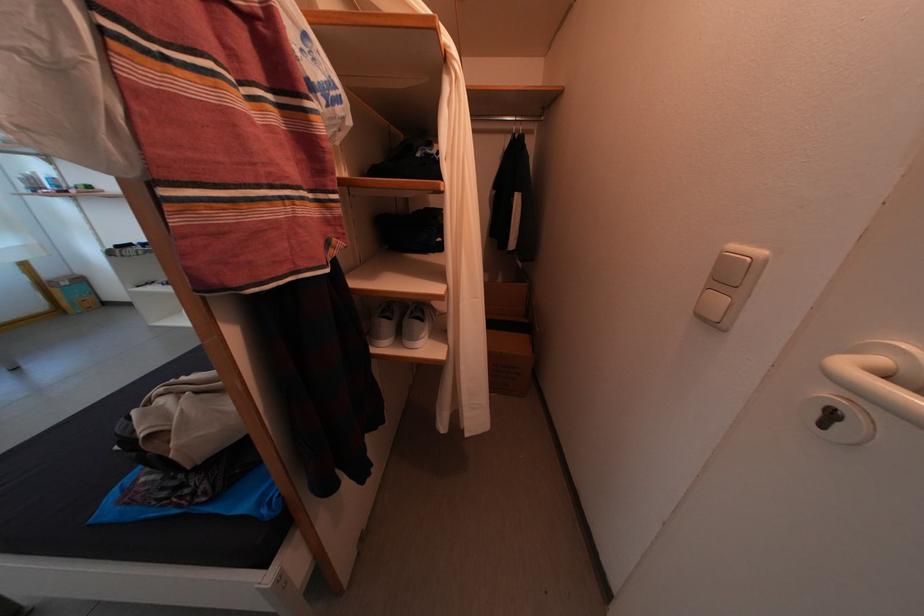
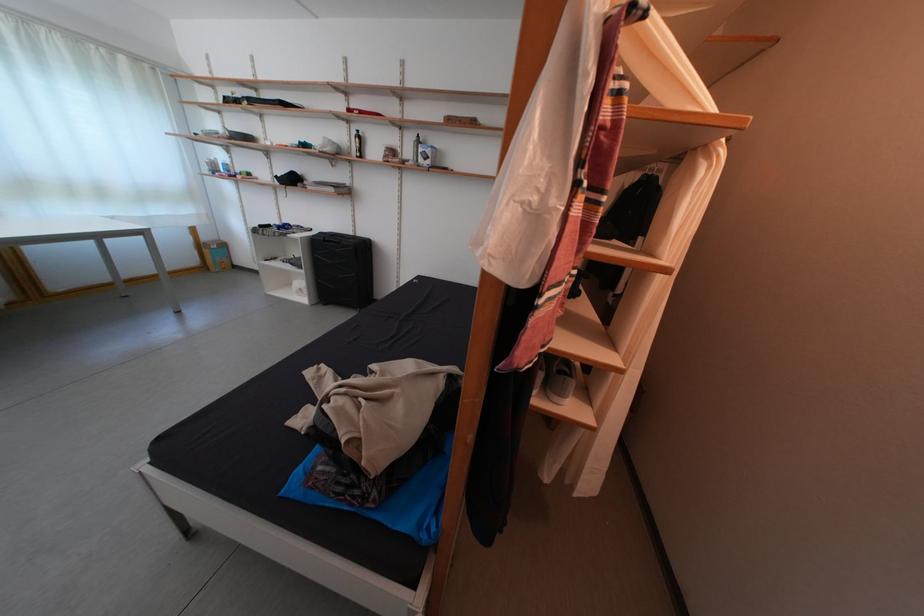
Question: The camera is either moving clockwise (left) or counter-clockwise (right) around the object. The first image is from the beginning of the video and the second image is from the end. Is the camera moving left or right when shooting the video?

Choices:
 (A) Left
 (B) Right

Answer: (B)